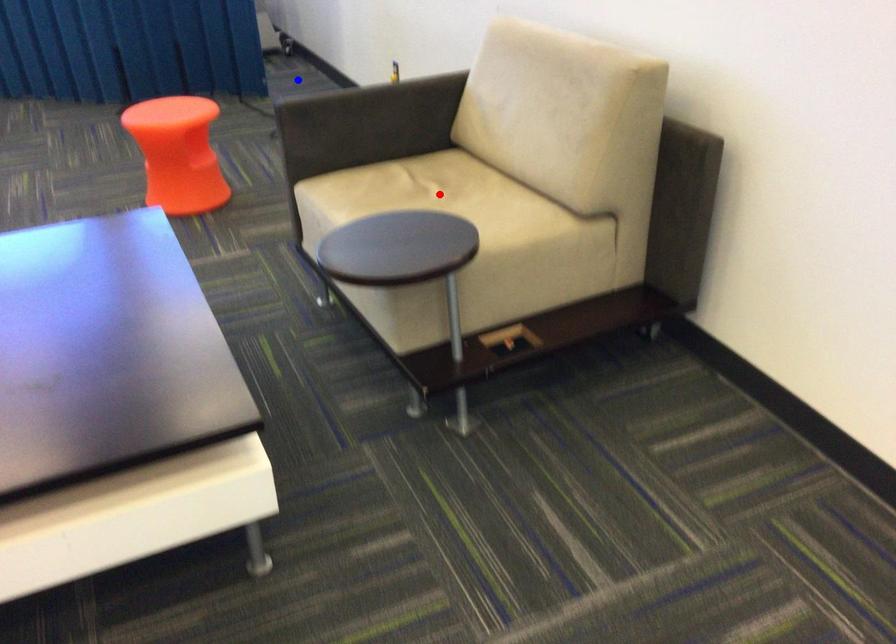
Question: Two points are marked on the image. Which point is closer to the camera?

Choices:
 (A) Blue point is closer.
 (B) Red point is closer.

Answer: (B)